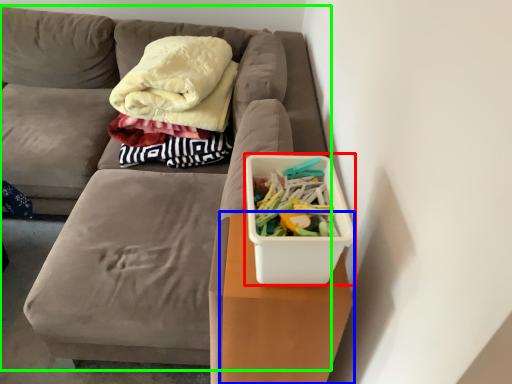
Question: Which object is the farthest from storage box (highlighted by a red box)? Choose among these: table (highlighted by a blue box) or furniture (highlighted by a green box).

Choices:
 (A) table
 (B) furniture

Answer: (B)